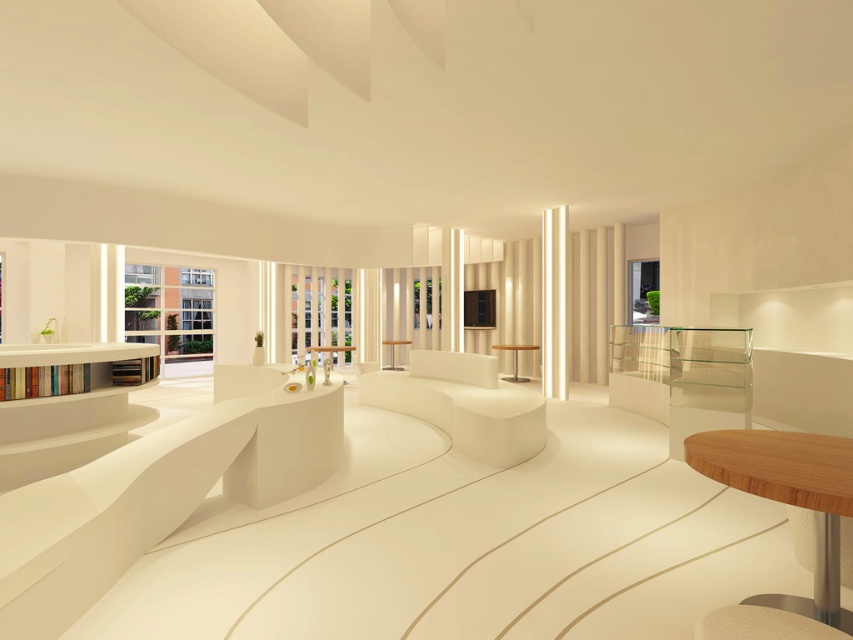
Is wooden table at center closer to camera compared to white glossy table at center?

No, wooden table at center is behind white glossy table at center.

Does wooden table at center have a smaller size compared to white glossy table at center?

Indeed, wooden table at center has a smaller size compared to white glossy table at center.

What do you see at coordinates (515, 358) in the screenshot?
I see `wooden table at center` at bounding box center [515, 358].

Identify the location of wooden table at center. (515, 358).

Does light brown wooden table at lower right have a greater height compared to white glossy table at center?

No, light brown wooden table at lower right is not taller than white glossy table at center.

Consider the image. Is light brown wooden table at lower right smaller than white glossy table at center?

Yes.

I want to click on light brown wooden table at lower right, so click(790, 504).

Is light brown wooden table at lower right taller than wooden table at center?

Incorrect, light brown wooden table at lower right's height is not larger of wooden table at center's.

Which of these two, light brown wooden table at lower right or wooden table at center, stands shorter?

Standing shorter between the two is light brown wooden table at lower right.

The height and width of the screenshot is (640, 853). Describe the element at coordinates (790, 504) in the screenshot. I see `light brown wooden table at lower right` at that location.

Image resolution: width=853 pixels, height=640 pixels. What are the coordinates of `light brown wooden table at lower right` in the screenshot? It's located at (790, 504).